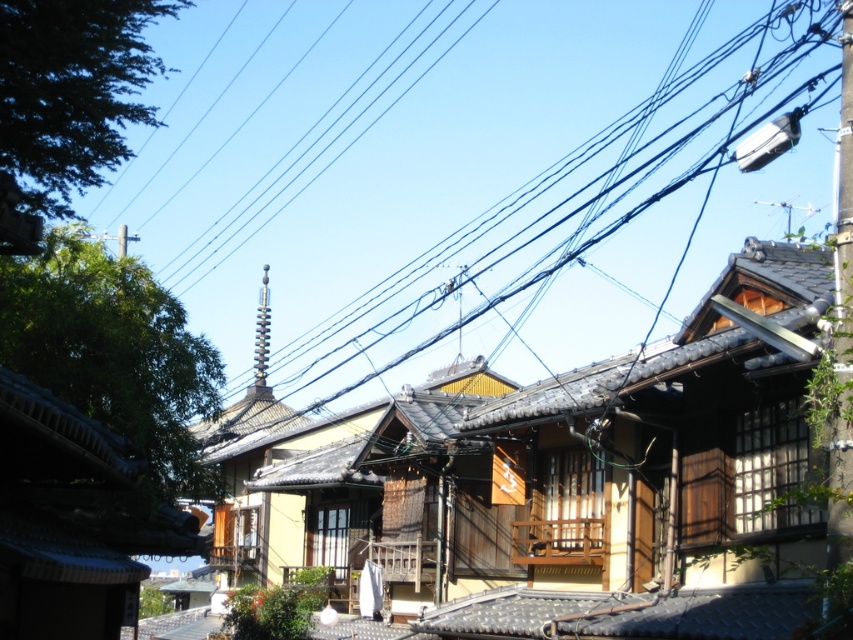
Which is below, black wire at upper center or metallic pole at upper right?

Positioned lower is metallic pole at upper right.

Between black wire at upper center and metallic pole at upper right, which one is positioned higher?

black wire at upper center is higher up.

Locate an element on the screen. black wire at upper center is located at coordinates (576, 216).

Identify the location of black wire at upper center. (576, 216).